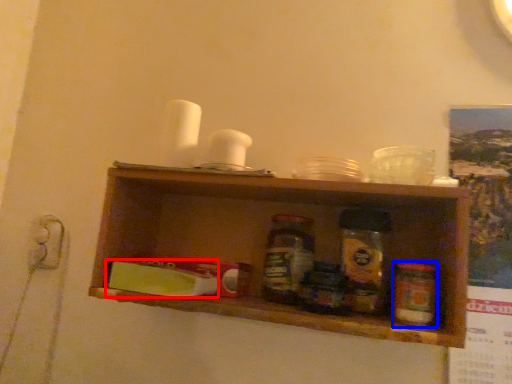
Question: Which object is further to the camera taking this photo, food (highlighted by a red box) or bottle (highlighted by a blue box)?

Choices:
 (A) food
 (B) bottle

Answer: (A)